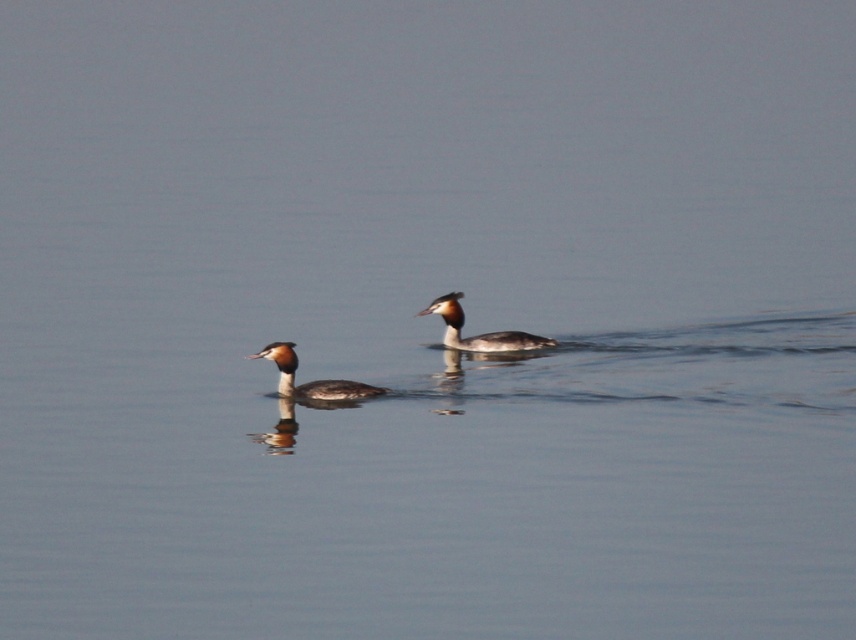
You are a nature photographer aiming to capture both the brown speckled duck at center and the brown glossy duck at center in a single frame. Given their sizes, which duck will appear larger in your photo?

The brown glossy duck at center will appear larger in the photo because it is larger than the brown speckled duck at center.

From the picture: You are a wildlife photographer aiming to capture a closeup shot of the brown speckled duck at center. Your camera has a maximum zoom range of 10 meters. Can you get a clear closeup shot without moving closer?

The brown speckled duck at center is 12.87 meters away from the camera, which exceeds the camera maximum zoom range of 10 meters. Therefore, you cannot get a clear closeup shot without moving closer.

From the picture: You are a birdwatcher observing two points on a map corresponding to the locations of the two Great Crested Grebes in the image. The coordinates are point [321,387] and point [474,339]. Which point is closer to you, the observer?

Point [321,387] is in front of point [474,339], so the point [321,387] is closer to you.